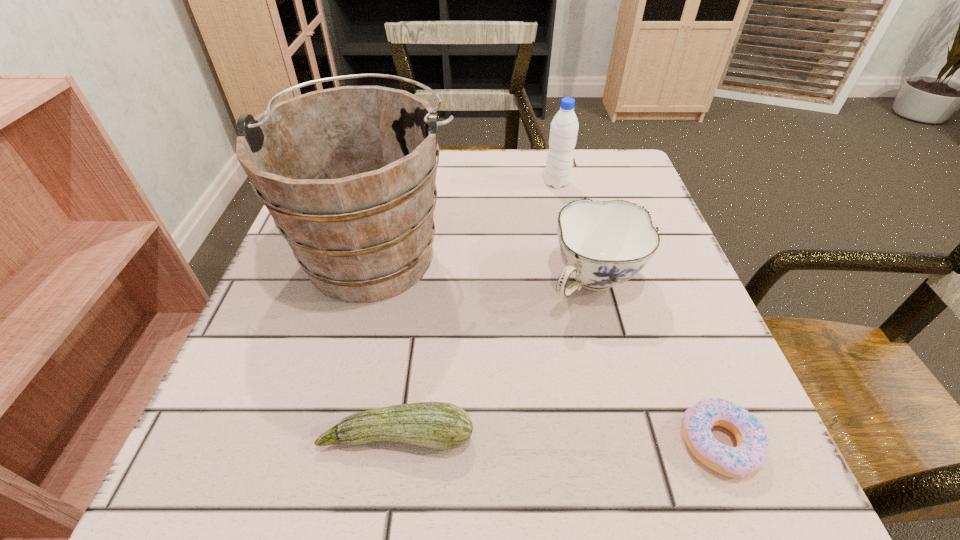
The width and height of the screenshot is (960, 540). Identify the location of free spot between the second tallest object and the shortest object. (638, 313).

Find the location of a particular element. vacant region between the doughnut and the zucchini is located at coordinates (559, 440).

The height and width of the screenshot is (540, 960). What are the coordinates of `free space between the bucket and the farthest object` in the screenshot? It's located at (466, 217).

The image size is (960, 540). In order to click on empty space between the second shortest object and the tallest object in this screenshot , I will do `click(386, 343)`.

Locate an element on the screen. The image size is (960, 540). free spot between the bucket and the farthest object is located at coordinates (466, 217).

Identify the location of free space between the farthest object and the zucchini. This screenshot has width=960, height=540. (477, 309).

The width and height of the screenshot is (960, 540). I want to click on vacant area that lies between the chinaware and the fourth tallest object, so click(x=495, y=359).

The height and width of the screenshot is (540, 960). What are the coordinates of `vacant space that is in between the fourth shortest object and the bucket` in the screenshot? It's located at (466, 217).

At what (x,y) coordinates should I click in order to perform the action: click on object that ranks as the fourth closest to the second tallest object. Please return your answer as a coordinate pair (x, y). Image resolution: width=960 pixels, height=540 pixels. Looking at the image, I should click on coord(439,425).

This screenshot has width=960, height=540. I want to click on object that is the closest to the chinaware, so click(x=752, y=450).